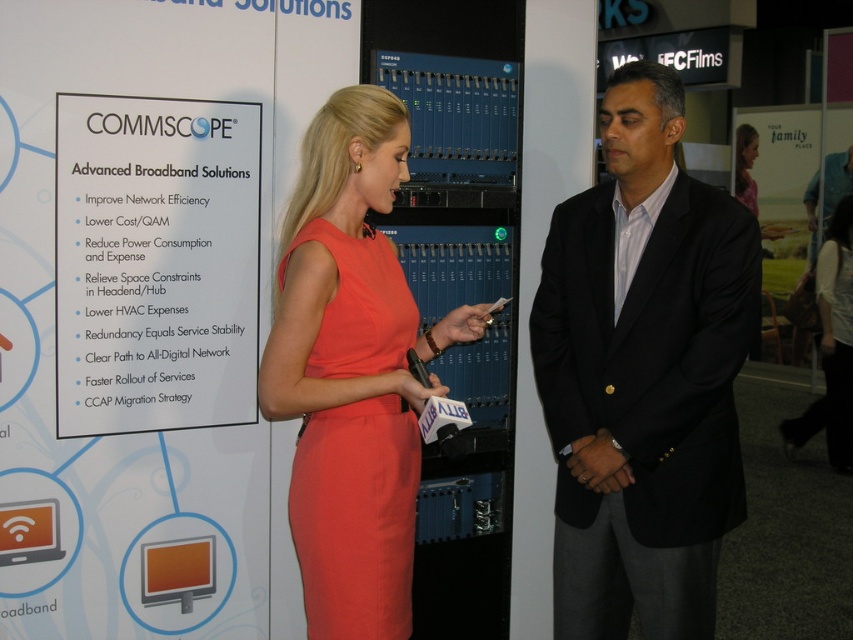
Is point (369, 454) farther from camera compared to point (376, 364)?

No, it is in front of (376, 364).

Who is more forward, (416,426) or (347,589)?

Point (347,589)

Measure the distance between orange fabric dress at center and camera.

The distance of orange fabric dress at center from camera is 1.68 meters.

The image size is (853, 640). I want to click on orange fabric dress at center, so click(x=352, y=371).

Is white paper at upper left bigger than orange fabric dress at center?

Yes, white paper at upper left is bigger than orange fabric dress at center.

Who is more distant from viewer, (167, 74) or (354, 385)?

The point (167, 74) is more distant.

This screenshot has height=640, width=853. What do you see at coordinates (148, 312) in the screenshot?
I see `white paper at upper left` at bounding box center [148, 312].

This screenshot has width=853, height=640. Identify the location of white paper at upper left. (148, 312).

Does white paper at upper left appear over pink fabric dress at upper center?

Actually, white paper at upper left is below pink fabric dress at upper center.

Locate an element on the screen. This screenshot has height=640, width=853. white paper at upper left is located at coordinates (148, 312).